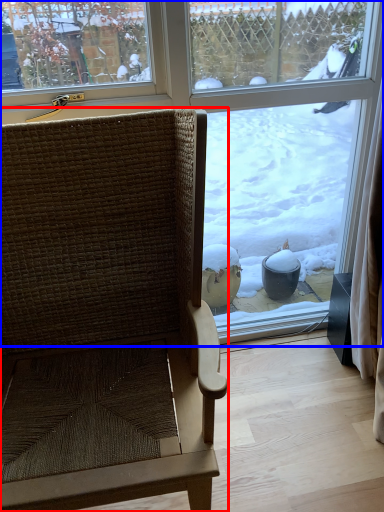
Question: Which object appears closest to the camera in this image, chair (highlighted by a red box) or window (highlighted by a blue box)?

Choices:
 (A) chair
 (B) window

Answer: (A)